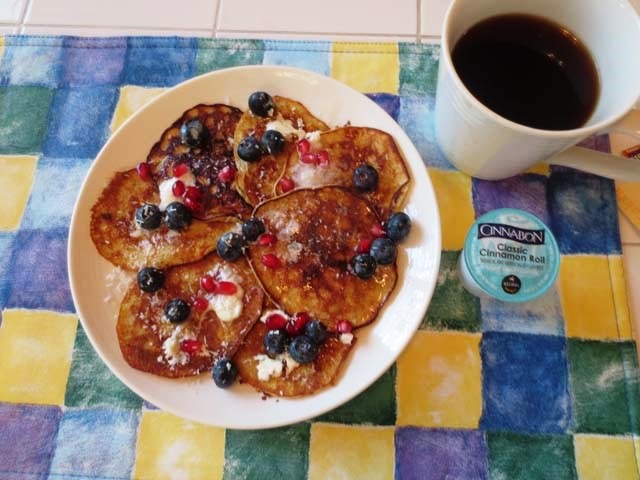
Locate an element on the screen. This screenshot has height=480, width=640. cup's handle is located at coordinates (598, 160).